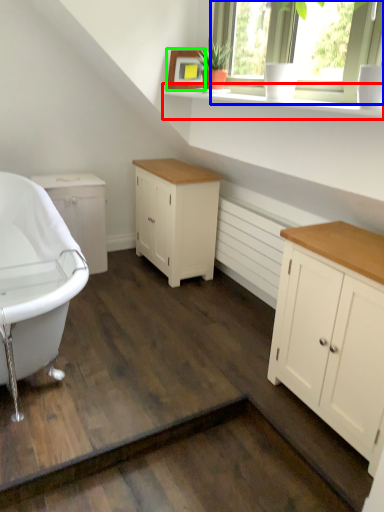
Question: Based on their relative distances, which object is farther from window sill (highlighted by a red box)? Choose from window (highlighted by a blue box) and picture frame (highlighted by a green box).

Choices:
 (A) window
 (B) picture frame

Answer: (B)